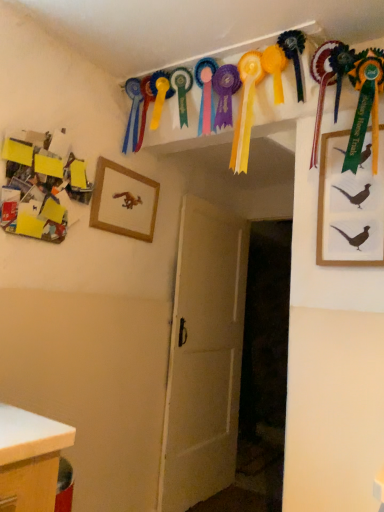
Question: In the image, is white matte desk at lower left on the left side or the right side of wooden picture frame at center-left, which is the 1th picture frame from back to front?

Choices:
 (A) left
 (B) right

Answer: (A)

Question: Is white matte desk at lower left in front of or behind wooden picture frame at center-left, which is the 1th picture frame from back to front, in the image?

Choices:
 (A) front
 (B) behind

Answer: (A)

Question: Estimate the real-world distances between objects in this image. Which object is closer to the white matte desk at lower left?

Choices:
 (A) wooden picture frame at center-left, arranged as the second picture frame when viewed from the right
 (B) yellow paper collage at upper left
 (C) silk green ribbon at upper right, arranged as the 1th picture frame when viewed from the right
 (D) white wooden door at center

Answer: (B)

Question: Which object is the farthest from the yellow paper collage at upper left?

Choices:
 (A) silk green ribbon at upper right, the second picture frame viewed from the left
 (B) white matte desk at lower left
 (C) wooden picture frame at center-left, arranged as the 1th picture frame when viewed from the left
 (D) white wooden door at center

Answer: (D)